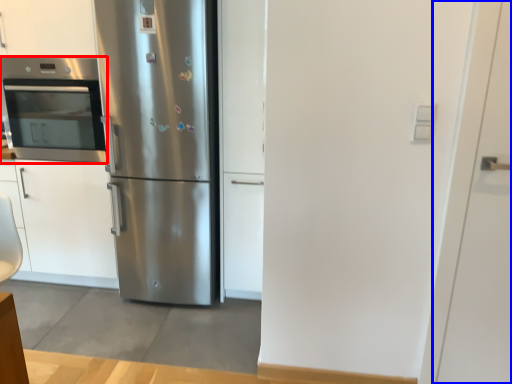
Question: Among these objects, which one is nearest to the camera, oven (highlighted by a red box) or door (highlighted by a blue box)?

Choices:
 (A) oven
 (B) door

Answer: (B)